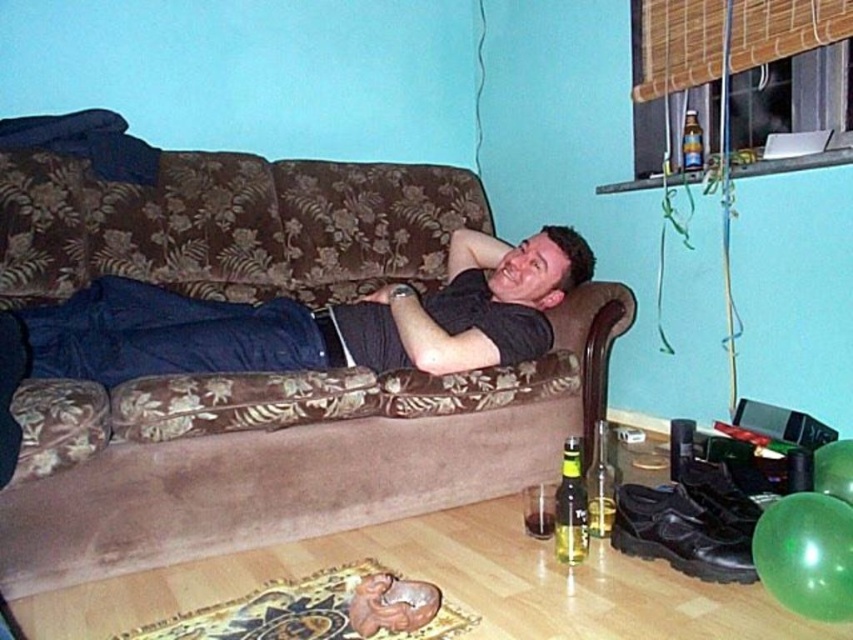
You are a delivery person entering the room and need to place a package on the floor. The package is as wide as the green glass bottle at lower center. Can you place it on the floor without overlapping the brown floral fabric couch at center?

The brown floral fabric couch at center is wider than the green glass bottle at lower center. Since the package has the same width as the green glass bottle at lower center, there should be enough space on the floor to place it without overlapping the brown floral fabric couch at center.

You are standing in the room and want to place a small item on the black matte shirt at center. Where should you aim to place it so that it lands directly on the shirt?

You should aim for the coordinates point (320, 321) where the black matte shirt at center is located.